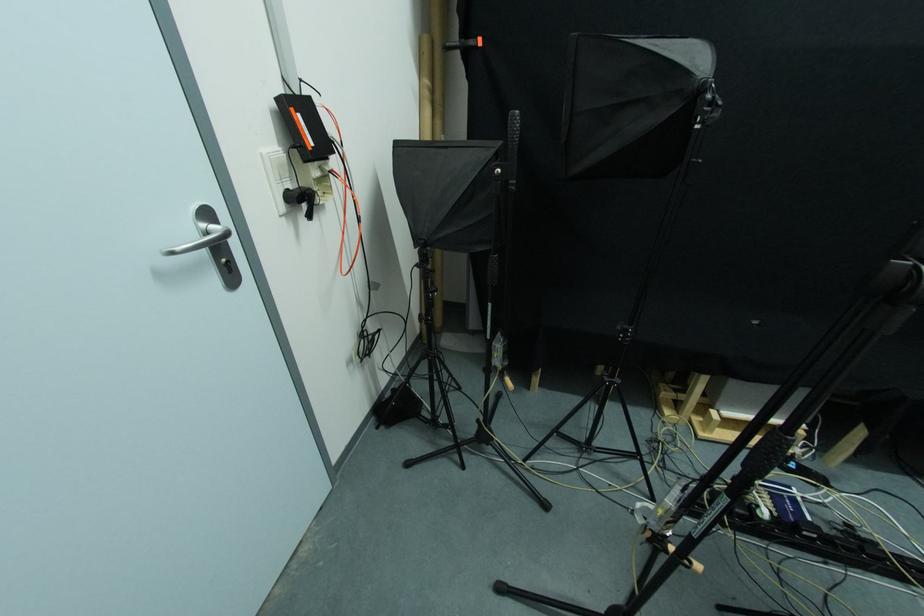
Identify the location of white light switch. This screenshot has width=924, height=616. (277, 176).